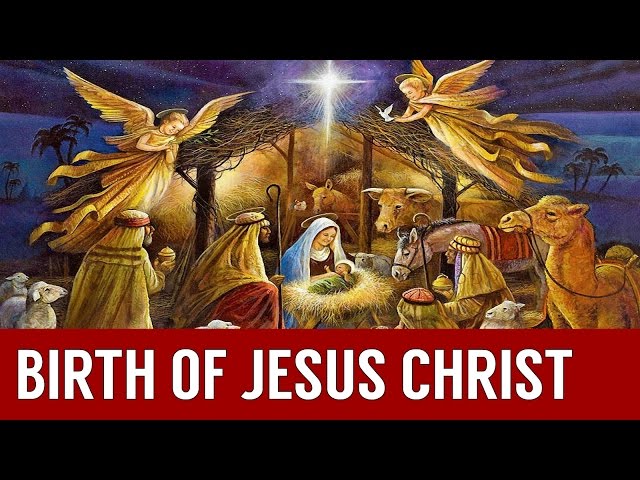
Where is `nativity  scene`? The image size is (640, 480). nativity  scene is located at coordinates (324, 245), (260, 343).